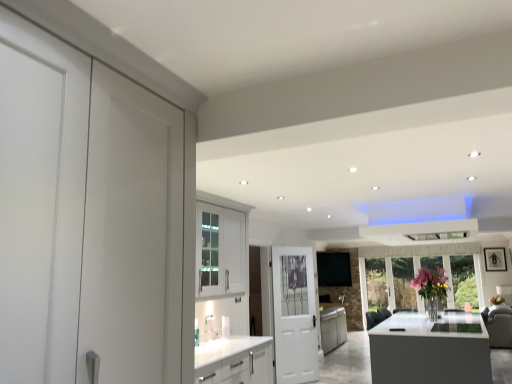
Question: Looking at their shapes, would you say white glossy door at center is wider or thinner than pink glass vase at center?

Choices:
 (A) wide
 (B) thin

Answer: (B)

Question: From a real-world perspective, is white glossy door at center above or below pink glass vase at center?

Choices:
 (A) below
 (B) above

Answer: (A)

Question: Is white glossy door at center inside the boundaries of pink glass vase at center, or outside?

Choices:
 (A) inside
 (B) outside

Answer: (B)

Question: Is pink glass vase at center bigger or smaller than white glossy door at center?

Choices:
 (A) small
 (B) big

Answer: (A)

Question: From a real-world perspective, is pink glass vase at center physically located above or below white glossy door at center?

Choices:
 (A) above
 (B) below

Answer: (A)

Question: Based on their positions, is pink glass vase at center located to the left or right of white glossy door at center?

Choices:
 (A) right
 (B) left

Answer: (A)

Question: From the image's perspective, is pink glass vase at center located above or below white glossy door at center?

Choices:
 (A) above
 (B) below

Answer: (A)